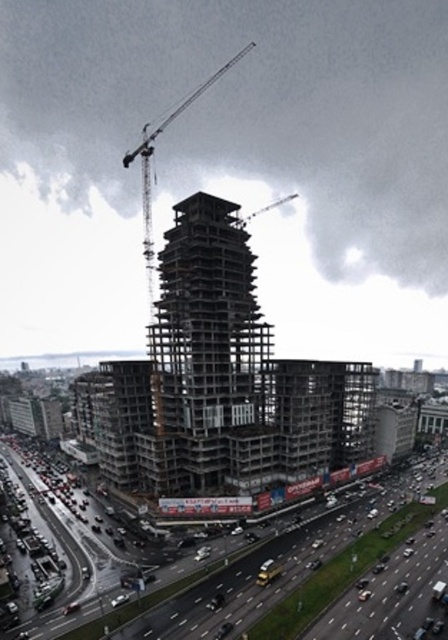
Question: Does asphalt road at center come behind metallic gray crane at center?

Choices:
 (A) no
 (B) yes

Answer: (A)

Question: Which point is farther to the camera?

Choices:
 (A) (236, 54)
 (B) (249, 300)
 (C) (358, 552)

Answer: (A)

Question: Can you confirm if concrete structure at center is smaller than asphalt road at center?

Choices:
 (A) no
 (B) yes

Answer: (A)

Question: Which object is positioned closest to the metallic gray crane at center?

Choices:
 (A) asphalt road at center
 (B) concrete structure at center

Answer: (B)

Question: Can you confirm if concrete structure at center is positioned to the right of asphalt road at center?

Choices:
 (A) yes
 (B) no

Answer: (B)

Question: Which point is closer to the camera?

Choices:
 (A) asphalt road at center
 (B) metallic gray crane at center
 (C) concrete structure at center

Answer: (A)